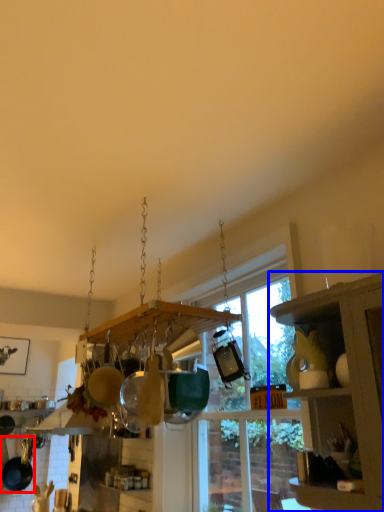
Question: Among these objects, which one is nearest to the camera, frying pan (highlighted by a red box) or cabinetry (highlighted by a blue box)?

Choices:
 (A) frying pan
 (B) cabinetry

Answer: (B)